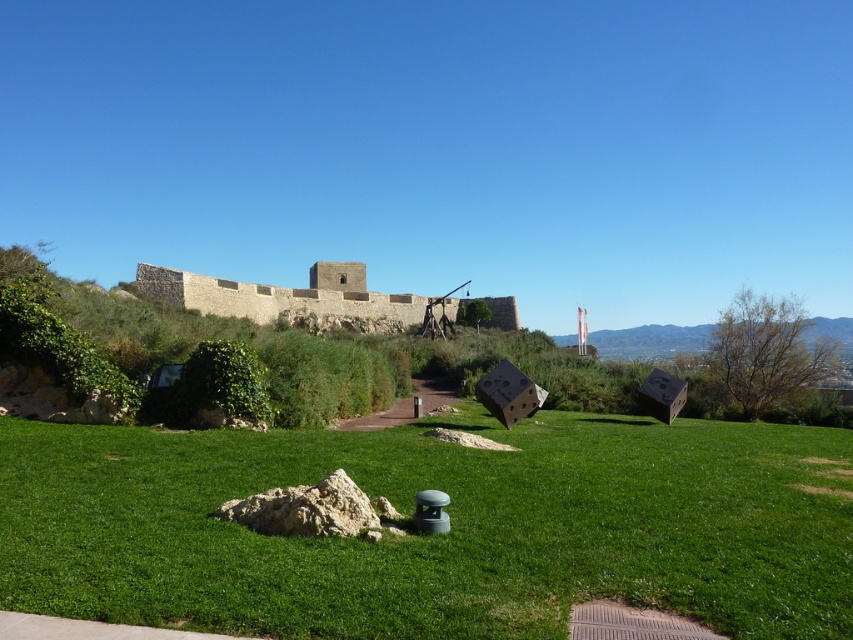
Question: Can you confirm if green grass at center is positioned to the left of stone wall at center?

Choices:
 (A) no
 (B) yes

Answer: (A)

Question: Considering the relative positions of green grass at center and stone wall at center in the image provided, where is green grass at center located with respect to stone wall at center?

Choices:
 (A) left
 (B) right

Answer: (B)

Question: Is green grass at center positioned behind stone wall at center?

Choices:
 (A) yes
 (B) no

Answer: (B)

Question: Which of the following is the farthest from the observer?

Choices:
 (A) (321, 624)
 (B) (248, 305)

Answer: (B)

Question: Which point is farther from the camera taking this photo?

Choices:
 (A) (439, 316)
 (B) (20, 442)

Answer: (A)

Question: Which of the following is the closest to the observer?

Choices:
 (A) green grass at center
 (B) stone wall at center

Answer: (A)